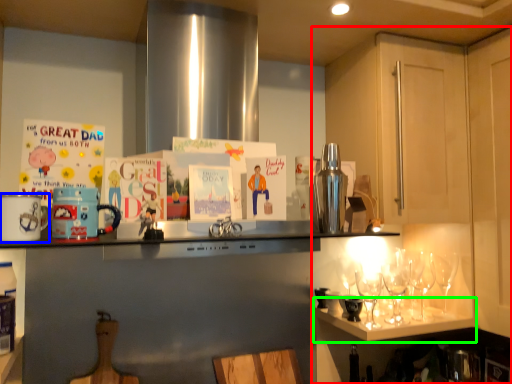
Question: Considering the real-world distances, which object is closest to cabinetry (highlighted by a red box)? appliance (highlighted by a blue box) or shelf (highlighted by a green box).

Choices:
 (A) appliance
 (B) shelf

Answer: (B)